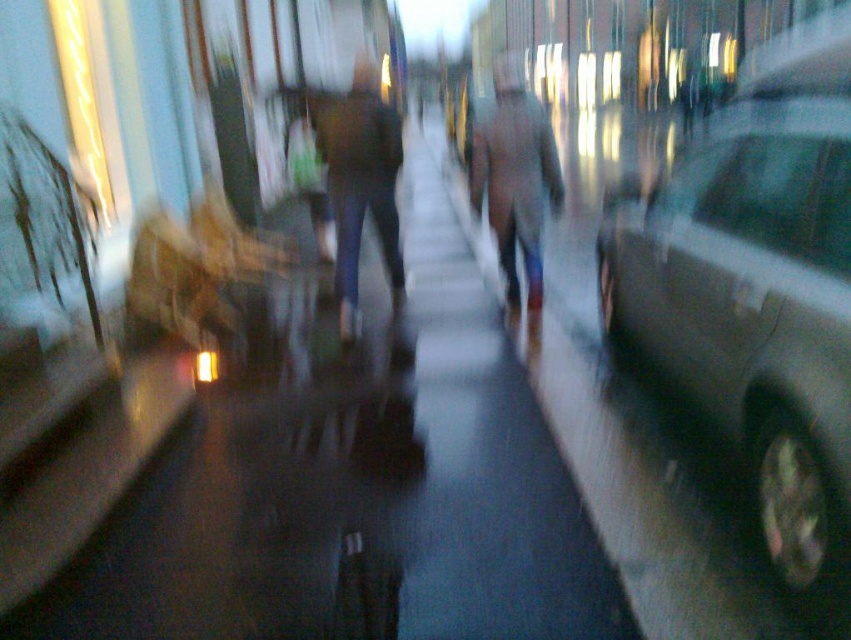
Question: Is dark blue jeans at center wider than gray wool coat at center?

Choices:
 (A) no
 (B) yes

Answer: (A)

Question: Which point is closer to the camera?

Choices:
 (A) (498, 192)
 (B) (714, 260)
 (C) (403, 296)

Answer: (B)

Question: Is dark asphalt sidewalk at center positioned at the back of gray wool coat at center?

Choices:
 (A) no
 (B) yes

Answer: (A)

Question: Can you confirm if metallic silver car at right is positioned to the left of gray wool coat at center?

Choices:
 (A) no
 (B) yes

Answer: (B)

Question: Which point is farther to the camera?

Choices:
 (A) metallic silver car at right
 (B) dark blue jeans at center

Answer: (B)

Question: Which point appears farthest from the camera in this image?

Choices:
 (A) (192, 538)
 (B) (627, 269)
 (C) (326, 115)
 (D) (530, 276)

Answer: (D)